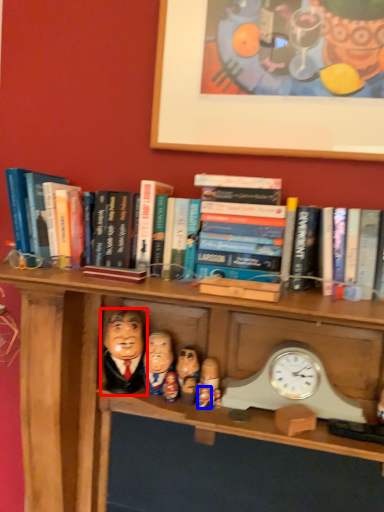
Question: Which object is further to the camera taking this photo, person (highlighted by a red box) or toy (highlighted by a blue box)?

Choices:
 (A) person
 (B) toy

Answer: (A)